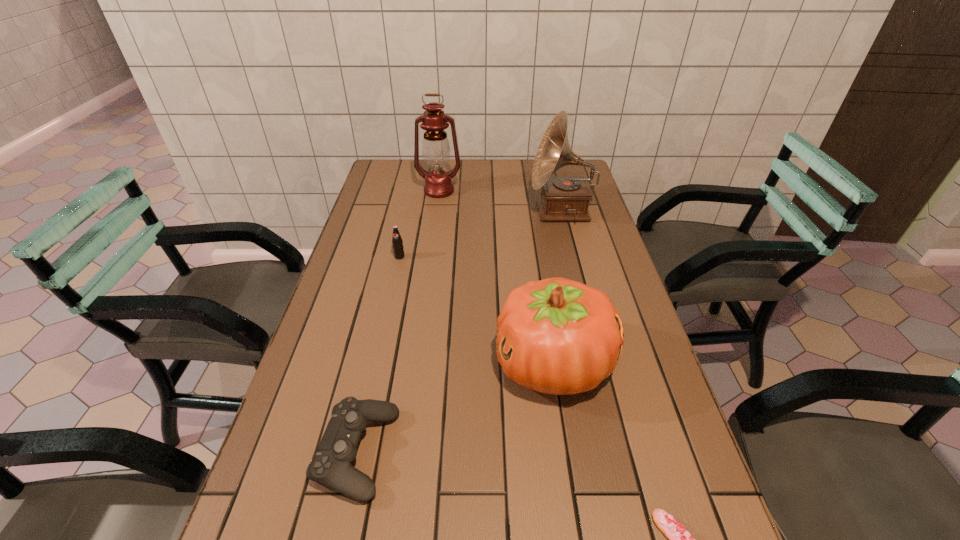
This screenshot has height=540, width=960. I want to click on oil lamp, so click(x=435, y=149).

Identify the location of phonograph record. The width and height of the screenshot is (960, 540). (563, 198).

Image resolution: width=960 pixels, height=540 pixels. What are the coordinates of `pumpkin` in the screenshot? It's located at (557, 336).

Image resolution: width=960 pixels, height=540 pixels. In order to click on pop in this screenshot , I will do coord(398,249).

Locate an element on the screen. The image size is (960, 540). the third farthest object is located at coordinates (398, 249).

Locate an element on the screen. control is located at coordinates (331, 466).

This screenshot has width=960, height=540. I want to click on vacant area situated 0.200m on the front of the oil lamp, so click(x=434, y=231).

Identify the location of free space located on the horn of the phonograph record. click(475, 211).

Where is `vacant space located on the horn of the phonograph record`? vacant space located on the horn of the phonograph record is located at coordinates (504, 211).

You are a GUI agent. You are given a task and a screenshot of the screen. Output one action in this format:
    pyautogui.click(x=<x>, y=<y>)
    Task: Click on the free region located on the horn of the phonograph record
    
    Given the screenshot: What is the action you would take?
    pyautogui.click(x=428, y=211)